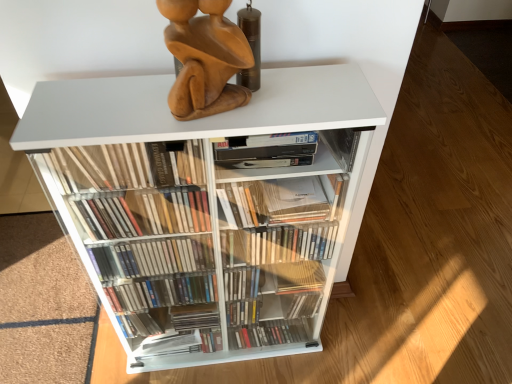
Locate an element on the screen. vacant space to the right of white plastic bookcase at center is located at coordinates (352, 345).